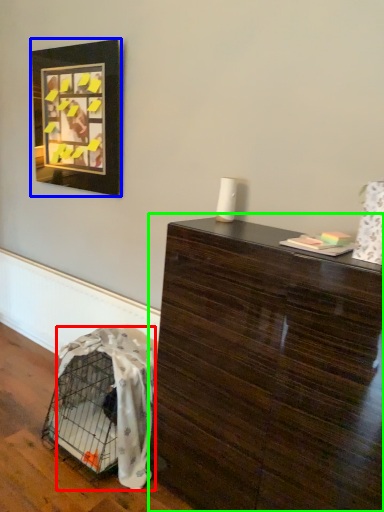
Question: Considering the real-world distances, which object is closest to blanket (highlighted by a red box)? picture frame (highlighted by a blue box) or table (highlighted by a green box).

Choices:
 (A) picture frame
 (B) table

Answer: (B)